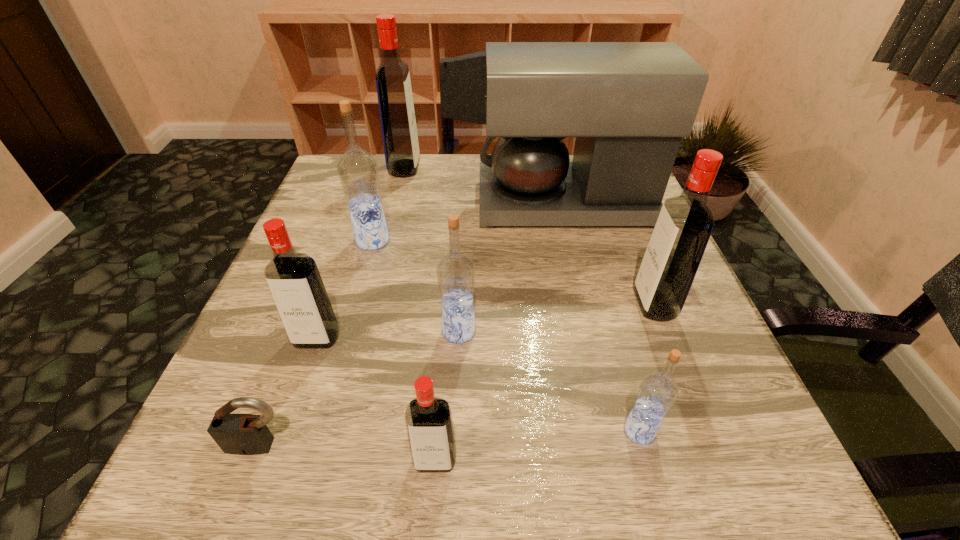
The height and width of the screenshot is (540, 960). Find the location of `free space located 0.240m on the front and back of the second biggest red vodka`. free space located 0.240m on the front and back of the second biggest red vodka is located at coordinates (505, 305).

Find the location of a particular element. The image size is (960, 540). vacant area situated on the front and back of the second biggest red vodka is located at coordinates pyautogui.click(x=609, y=305).

Identify the location of vacant space located on the front and back of the second biggest red vodka. This screenshot has width=960, height=540. (592, 305).

Locate an element on the screen. blank space located on the back of the second smallest blue vodka is located at coordinates (465, 198).

Identify the location of free point located on the front and back of the third farthest red vodka. (283, 436).

Identify the location of free space located on the left of the rightmost blue vodka. (413, 431).

What are the coordinates of `vodka present at the far edge` in the screenshot? It's located at (398, 124).

The image size is (960, 540). I want to click on coffee maker that is positioned at the far edge, so click(628, 104).

What are the coordinates of `padlock located at the near edge` in the screenshot? It's located at (241, 434).

At what (x,y) coordinates should I click in order to perform the action: click on padlock present at the left edge. Please return your answer as a coordinate pair (x, y). Looking at the image, I should click on (241, 434).